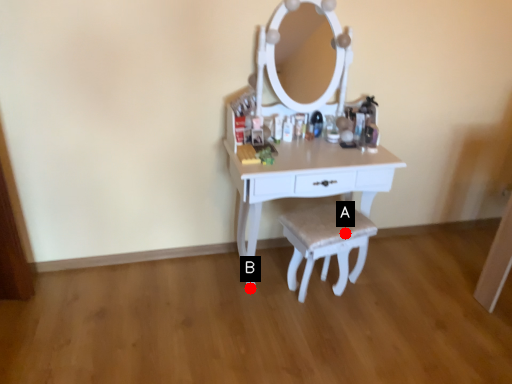
Question: Two points are circled on the image, labeled by A and B beside each circle. Which point is further to the camera?

Choices:
 (A) A is further
 (B) B is further

Answer: (B)